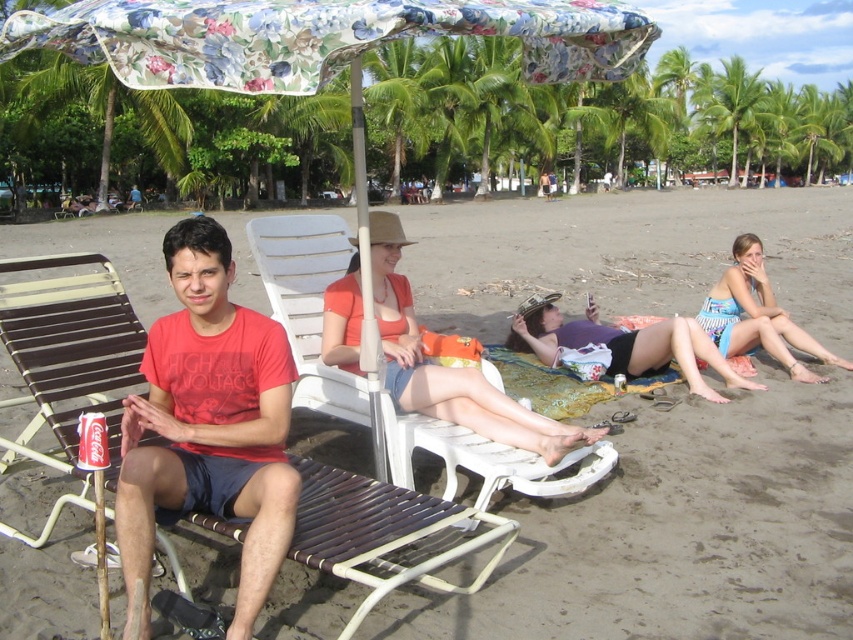
Question: Is matte purple bikini at center positioned behind striped fabric bikini bottom at lower right?

Choices:
 (A) yes
 (B) no

Answer: (B)

Question: Can you confirm if matte red t-shirt at left is positioned below matte purple bikini at center?

Choices:
 (A) yes
 (B) no

Answer: (A)

Question: Which point appears farthest from the camera in this image?

Choices:
 (A) (262, 4)
 (B) (117, 467)
 (C) (251, 531)
 (D) (693, 360)

Answer: (D)

Question: Which object appears closest to the camera in this image?

Choices:
 (A) matte purple bikini at center
 (B) striped fabric bikini bottom at lower right

Answer: (A)

Question: Which object is closer to the camera taking this photo?

Choices:
 (A) brown woven beach chair at left
 (B) floral fabric umbrella at upper center

Answer: (B)

Question: Can you confirm if orange fabric bikini top at center is positioned below striped fabric bikini bottom at lower right?

Choices:
 (A) yes
 (B) no

Answer: (A)